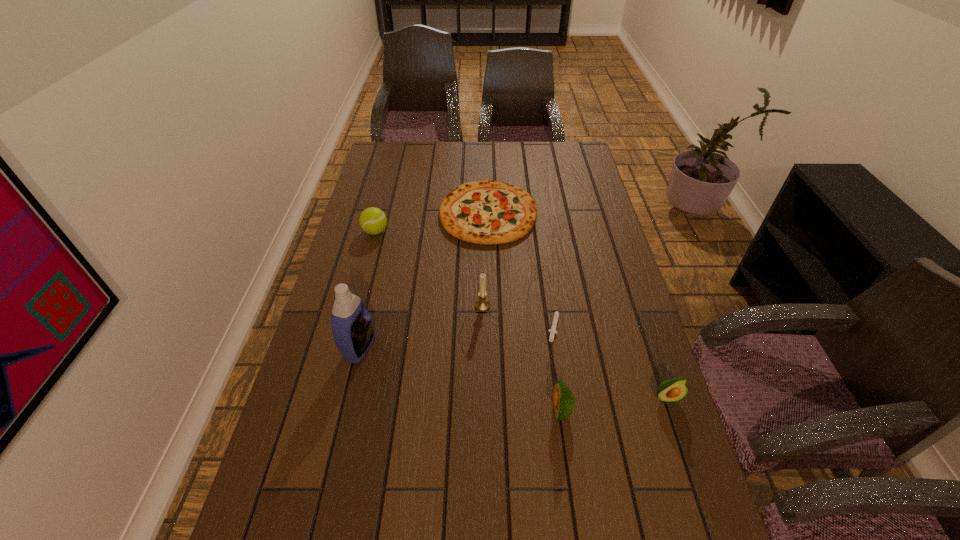
In the current image, all avocados are evenly spaced. To maintain this equal spacing, where should an additional avocado be placed on the left? Please point out a free spot. Please provide its 2D coordinates. Your answer should be formatted as a tuple, i.e. [(x, y)], where the tuple contains the x and y coordinates of a point satisfying the conditions above.

[(450, 424)]